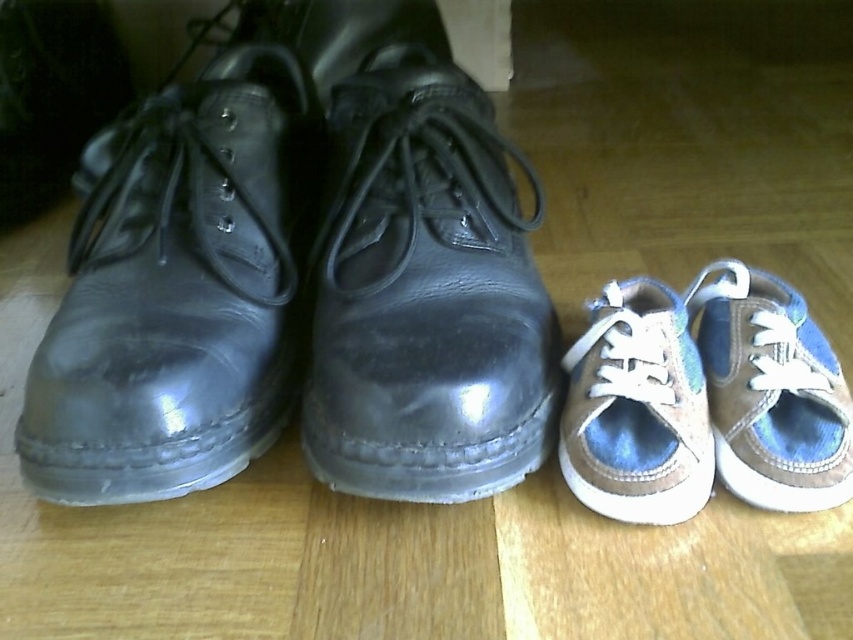
You are standing in a room with two pairs of shoes. You need to find the shiny black leather dress shoe at left and the glossy leather shoe at center. Which one is located lower in the image?

The shiny black leather dress shoe at left is located lower in the image than the glossy leather shoe at center.

You are standing in a room and want to pick up the glossy leather shoe at center and the tan suede sneaker at lower right. Which one do you need to move first to reach the other?

The glossy leather shoe at center is in front of the tan suede sneaker at lower right, so you need to move the glossy leather shoe at center first to reach the tan suede sneaker at lower right.